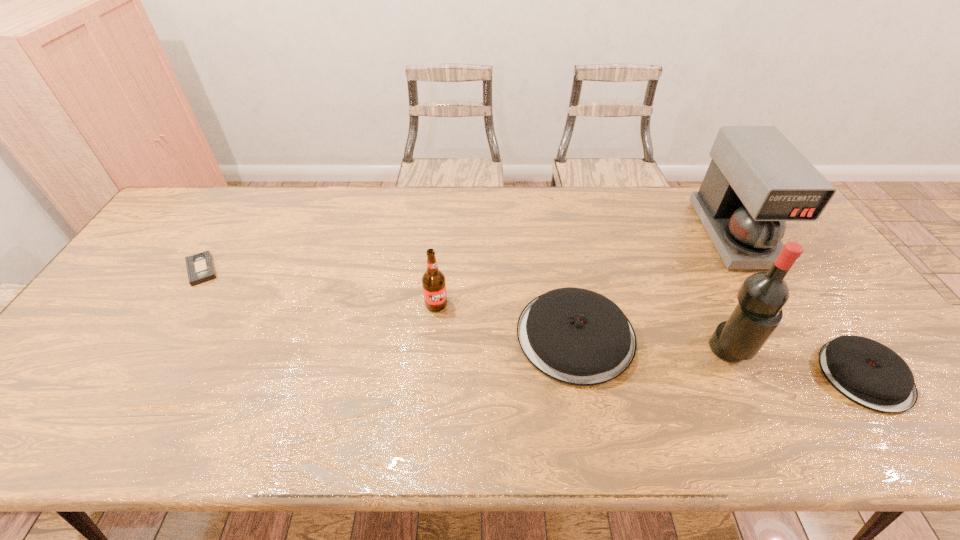
Find the location of a particular element. This screenshot has width=960, height=540. pancake that is positioned at the right edge is located at coordinates (868, 373).

Image resolution: width=960 pixels, height=540 pixels. Find the location of `coffee maker located in the right edge section of the desktop`. coffee maker located in the right edge section of the desktop is located at coordinates 757,180.

Locate an element on the screen. This screenshot has width=960, height=540. object at the far right corner is located at coordinates click(x=757, y=180).

This screenshot has width=960, height=540. What are the coordinates of `object located in the near right corner section of the desktop` in the screenshot? It's located at (868, 373).

I want to click on blank space at the far edge of the desktop, so click(427, 208).

Image resolution: width=960 pixels, height=540 pixels. Identify the location of vacant space at the near edge of the desktop. (641, 380).

Image resolution: width=960 pixels, height=540 pixels. In the image, there is a desktop. Find the location of `vacant area at the left edge`. vacant area at the left edge is located at coordinates (137, 267).

This screenshot has height=540, width=960. Identify the location of vacant space at the far left corner of the desktop. (218, 187).

Locate an element on the screen. vacant region between the fifth object from right to left and the coffee maker is located at coordinates (585, 269).

I want to click on blank region between the root beer and the left pancake, so pyautogui.click(x=506, y=320).